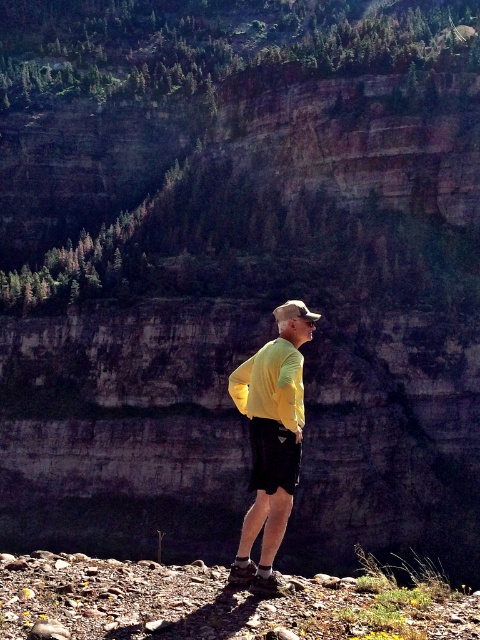
Between yellow matte shirt at center and camouflage fabric baseball cap at center, which one has less height?

camouflage fabric baseball cap at center

The image size is (480, 640). What do you see at coordinates (271, 445) in the screenshot?
I see `yellow matte shirt at center` at bounding box center [271, 445].

Locate an element on the screen. Image resolution: width=480 pixels, height=640 pixels. yellow matte shirt at center is located at coordinates (271, 445).

Between black cotton shorts at lower center and camouflage fabric baseball cap at center, which one appears on the right side from the viewer's perspective?

camouflage fabric baseball cap at center is more to the right.

Which is behind, point (294, 461) or point (298, 308)?

The point (298, 308) is behind.

This screenshot has width=480, height=640. Find the location of `black cotton shorts at lower center`. black cotton shorts at lower center is located at coordinates (273, 456).

Image resolution: width=480 pixels, height=640 pixels. Identify the location of yellow matte shirt at center. [271, 445].

Is yellow matte shirt at center closer to the viewer compared to black cotton shorts at lower center?

Yes, it is.

Locate an element on the screen. This screenshot has width=480, height=640. yellow matte shirt at center is located at coordinates (271, 445).

Where is `yellow matte shirt at center`? The height and width of the screenshot is (640, 480). yellow matte shirt at center is located at coordinates (271, 445).